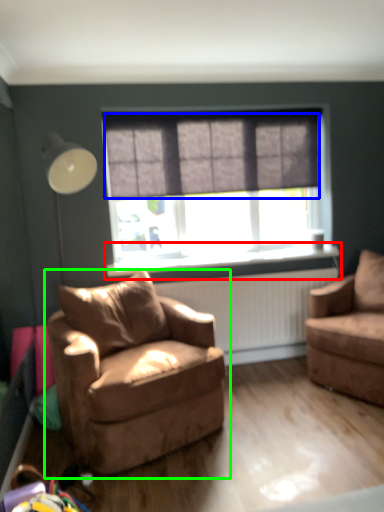
Question: Based on their relative distances, which object is farther from window sill (highlighted by a red box)? Choose from curtain (highlighted by a blue box) and chair (highlighted by a green box).

Choices:
 (A) curtain
 (B) chair

Answer: (B)